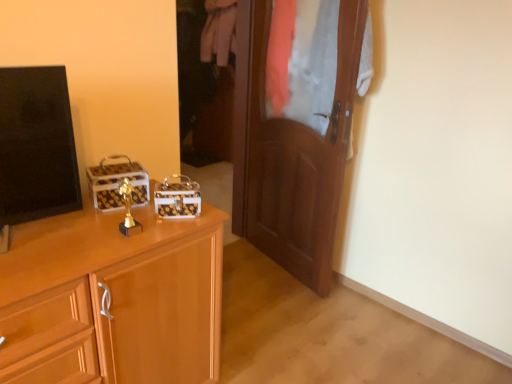
Find the location of a particular element. The width and height of the screenshot is (512, 384). vacant area situated below black glossy tv at left (from a real-world perspective) is located at coordinates (44, 230).